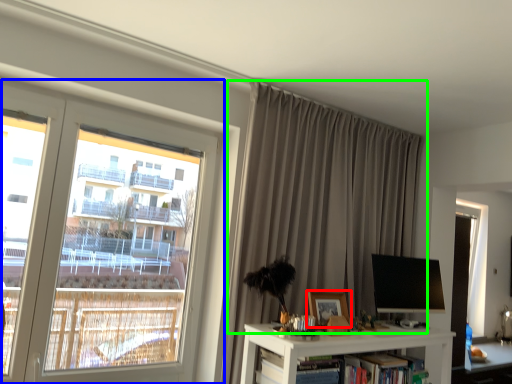
Question: Which object is positioned farthest from picture frame (highlighted by a red box)? Select from window (highlighted by a blue box) and curtain (highlighted by a green box).

Choices:
 (A) window
 (B) curtain

Answer: (A)